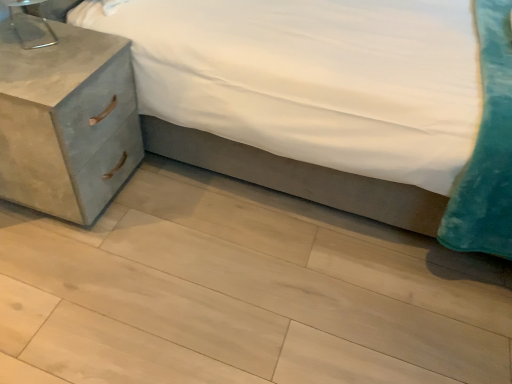
You are a GUI agent. You are given a task and a screenshot of the screen. Output one action in this format:
    pyautogui.click(x=<x>, y=<y>)
    Task: Click on the light wood floor at lower center
    This screenshot has height=384, width=512.
    Given the screenshot: What is the action you would take?
    click(331, 285)

Identify the location of light wood floor at lower center. (331, 285).

Could you tell me if matte concrete nightstand at left is turned towards metallic silver table lamp at upper left?

No, matte concrete nightstand at left is not turned towards metallic silver table lamp at upper left.

Does matte concrete nightstand at left appear on the left side of metallic silver table lamp at upper left?

No, matte concrete nightstand at left is not to the left of metallic silver table lamp at upper left.

From a real-world perspective, is matte concrete nightstand at left positioned above or below metallic silver table lamp at upper left?

matte concrete nightstand at left is below metallic silver table lamp at upper left.

Is matte concrete nightstand at left not near metallic silver table lamp at upper left?

No.

Find the location of a particular element. The width and height of the screenshot is (512, 384). table lamp below the velvet teal pillow at lower right (from the image's perspective) is located at coordinates [30, 25].

In the scene shown: Could you tell me if metallic silver table lamp at upper left is facing velvet teal pillow at lower right?

Yes.

Between metallic silver table lamp at upper left and velvet teal pillow at lower right, which one has less height?

Standing shorter between the two is metallic silver table lamp at upper left.

Between metallic silver table lamp at upper left and velvet teal pillow at lower right, which one has larger width?

velvet teal pillow at lower right.

In the image, there is a velvet teal pillow at lower right. Where is `table lamp below it (from the image's perspective)`? This screenshot has width=512, height=384. table lamp below it (from the image's perspective) is located at coordinates (30, 25).

Are velvet teal pillow at lower right and metallic silver table lamp at upper left beside each other?

No, velvet teal pillow at lower right is not touching metallic silver table lamp at upper left.

Is velvet teal pillow at lower right completely or partially outside of metallic silver table lamp at upper left?

Yes, velvet teal pillow at lower right is not within metallic silver table lamp at upper left.

Considering the sizes of objects velvet teal pillow at lower right and metallic silver table lamp at upper left in the image provided, who is smaller, velvet teal pillow at lower right or metallic silver table lamp at upper left?

metallic silver table lamp at upper left.

Consider the image. Can you confirm if metallic silver table lamp at upper left is wider than matte concrete nightstand at left?

In fact, metallic silver table lamp at upper left might be narrower than matte concrete nightstand at left.

From the image's perspective, which one is positioned lower, metallic silver table lamp at upper left or matte concrete nightstand at left?

From the image's view, matte concrete nightstand at left is below.

Is metallic silver table lamp at upper left positioned behind matte concrete nightstand at left?

Yes, metallic silver table lamp at upper left is further from the viewer.

How distant is metallic silver table lamp at upper left from matte concrete nightstand at left?

metallic silver table lamp at upper left is 9.74 inches away from matte concrete nightstand at left.

Between light wood floor at lower center and velvet teal pillow at lower right, which one has larger size?

velvet teal pillow at lower right.

Which is more to the left, light wood floor at lower center or velvet teal pillow at lower right?

light wood floor at lower center is more to the left.

Which is further, (316, 277) or (51, 17)?

The point (316, 277) is farther.

From a real-world perspective, is metallic silver table lamp at upper left located higher than light wood floor at lower center?

Yes, from a real-world perspective, metallic silver table lamp at upper left is on top of light wood floor at lower center.

Does metallic silver table lamp at upper left lie behind light wood floor at lower center?

Yes.

Is metallic silver table lamp at upper left situated inside light wood floor at lower center or outside?

metallic silver table lamp at upper left cannot be found inside light wood floor at lower center.

Between metallic silver table lamp at upper left and light wood floor at lower center, which one has larger width?

With larger width is light wood floor at lower center.

Considering the sizes of objects matte concrete nightstand at left and light wood floor at lower center in the image provided, who is shorter, matte concrete nightstand at left or light wood floor at lower center?

light wood floor at lower center.

Where is `nightstand above the light wood floor at lower center (from a real-world perspective)`? This screenshot has width=512, height=384. nightstand above the light wood floor at lower center (from a real-world perspective) is located at coordinates (67, 122).

Can you confirm if matte concrete nightstand at left is wider than light wood floor at lower center?

No.

Is matte concrete nightstand at left turned away from light wood floor at lower center?

→ matte concrete nightstand at left is not turned away from light wood floor at lower center.

You are a GUI agent. You are given a task and a screenshot of the screen. Output one action in this format:
    pyautogui.click(x=<x>, y=<y>)
    Task: Click on the table lamp on the left of matte concrete nightstand at left
    Image resolution: width=512 pixels, height=384 pixels.
    Given the screenshot: What is the action you would take?
    [x=30, y=25]

At what (x,y) coordinates should I click in order to perform the action: click on table lamp that appears above the velvet teal pillow at lower right (from a real-world perspective). Please return your answer as a coordinate pair (x, y). Image resolution: width=512 pixels, height=384 pixels. Looking at the image, I should click on point(30,25).

Estimate the real-world distances between objects in this image. Which object is closer to matte concrete nightstand at left, light wood floor at lower center or velvet teal pillow at lower right?

light wood floor at lower center is positioned closer to the anchor matte concrete nightstand at left.

Estimate the real-world distances between objects in this image. Which object is closer to velvet teal pillow at lower right, light wood floor at lower center or metallic silver table lamp at upper left?

light wood floor at lower center is positioned closer to the anchor velvet teal pillow at lower right.

When comparing their distances from metallic silver table lamp at upper left, does light wood floor at lower center or velvet teal pillow at lower right seem closer?

Among the two, light wood floor at lower center is located nearer to metallic silver table lamp at upper left.

Looking at this image, which object lies nearer to the anchor point light wood floor at lower center, velvet teal pillow at lower right or metallic silver table lamp at upper left?

velvet teal pillow at lower right.

Which object lies nearer to the anchor point light wood floor at lower center, metallic silver table lamp at upper left or velvet teal pillow at lower right?

velvet teal pillow at lower right is closer to light wood floor at lower center.

Estimate the real-world distances between objects in this image. Which object is further from matte concrete nightstand at left, light wood floor at lower center or metallic silver table lamp at upper left?

The object further to matte concrete nightstand at left is light wood floor at lower center.

When comparing their distances from matte concrete nightstand at left, does velvet teal pillow at lower right or light wood floor at lower center seem further?

velvet teal pillow at lower right.

From the image, which object appears to be farther from velvet teal pillow at lower right, matte concrete nightstand at left or metallic silver table lamp at upper left?

metallic silver table lamp at upper left.

You are a GUI agent. You are given a task and a screenshot of the screen. Output one action in this format:
    pyautogui.click(x=<x>, y=<y>)
    Task: Click on the nightstand between metallic silver table lamp at upper left and light wood floor at lower center from top to bottom
    Image resolution: width=512 pixels, height=384 pixels.
    Given the screenshot: What is the action you would take?
    pyautogui.click(x=67, y=122)

Locate an element on the screen. nightstand between velvet teal pillow at lower right and light wood floor at lower center in the up-down direction is located at coordinates (67, 122).

You are a GUI agent. You are given a task and a screenshot of the screen. Output one action in this format:
    pyautogui.click(x=<x>, y=<y>)
    Task: Click on the table lamp that lies between velvet teal pillow at lower right and light wood floor at lower center from top to bottom
    The width and height of the screenshot is (512, 384).
    Given the screenshot: What is the action you would take?
    pyautogui.click(x=30, y=25)

Locate an element on the screen. nightstand situated between metallic silver table lamp at upper left and velvet teal pillow at lower right from left to right is located at coordinates (67, 122).